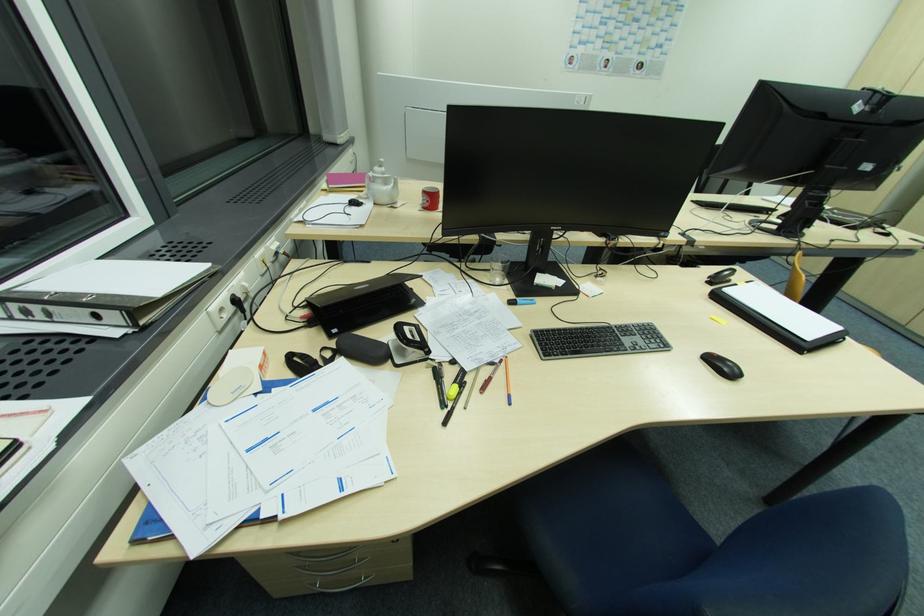
What do you see at coordinates (381, 185) in the screenshot?
I see `a dispenser pump top` at bounding box center [381, 185].